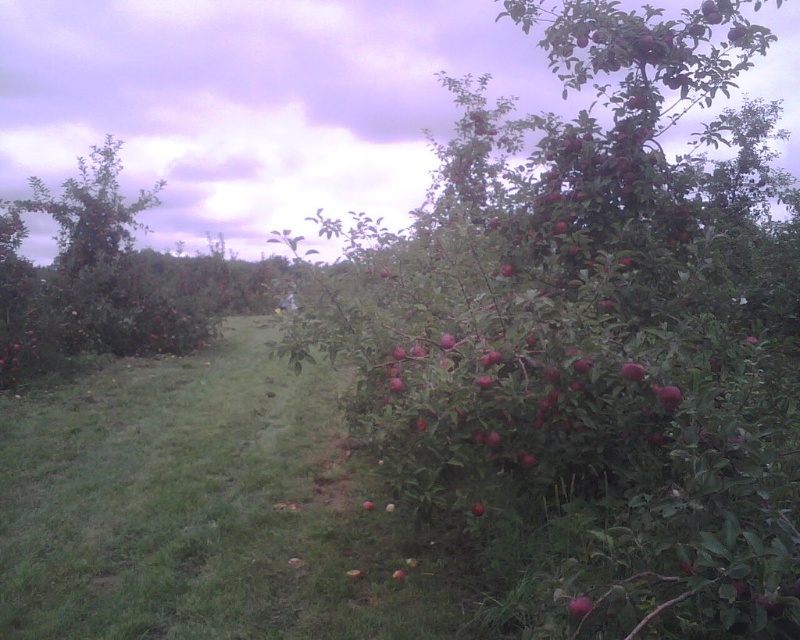
Question: Which object is farther from the camera taking this photo?

Choices:
 (A) red matte apple at center-right
 (B) shiny red apple at lower right
 (C) green grass at center
 (D) shiny red apple at center right

Answer: (C)

Question: Which of the following is the farthest from the observer?

Choices:
 (A) shiny red apple at lower right
 (B) green grass at center
 (C) shiny red apple at center right
 (D) red matte apple at center-right

Answer: (B)

Question: Is green grass at center closer to the viewer compared to shiny red apple at center right?

Choices:
 (A) yes
 (B) no

Answer: (B)

Question: Does green grass at center appear over red matte apple at center-right?

Choices:
 (A) no
 (B) yes

Answer: (A)

Question: Which object is farther from the camera taking this photo?

Choices:
 (A) red matte apple at center-right
 (B) shiny red apple at center right
 (C) green grass at center
 (D) shiny red apple at lower right

Answer: (C)

Question: Does red matte apple at center-right appear on the right side of shiny red apple at lower right?

Choices:
 (A) yes
 (B) no

Answer: (A)